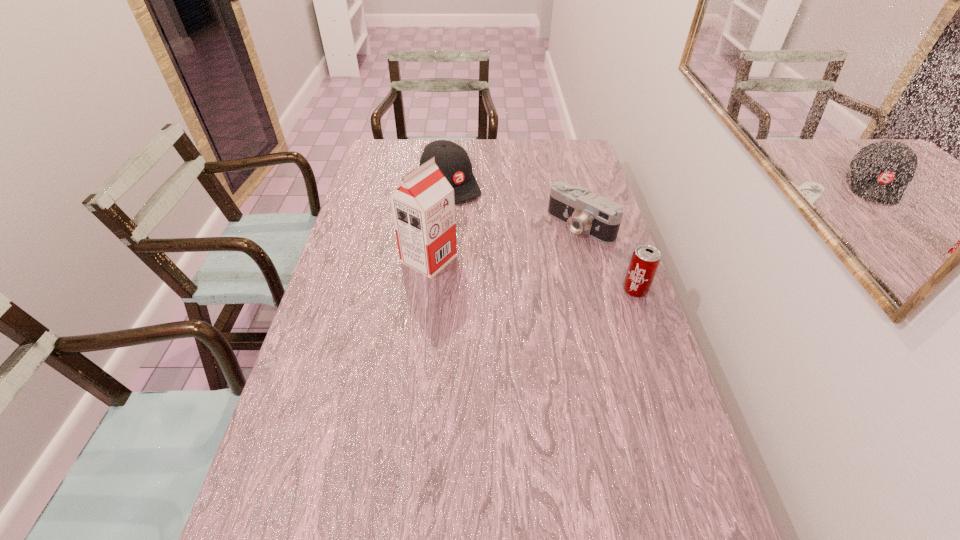
Find the location of `the tallest object`. the tallest object is located at coordinates (423, 208).

This screenshot has width=960, height=540. In order to click on the nearest object in this screenshot , I will do `click(645, 260)`.

Where is `baseball cap`? The width and height of the screenshot is (960, 540). baseball cap is located at coordinates click(452, 159).

Where is `the shortest object`? Image resolution: width=960 pixels, height=540 pixels. the shortest object is located at coordinates (598, 217).

You are a GUI agent. You are given a task and a screenshot of the screen. Output one action in this format:
    pyautogui.click(x=<x>, y=<y>)
    Task: Click on the vacant space situated on the right of the tallest object
    
    Given the screenshot: What is the action you would take?
    pyautogui.click(x=572, y=259)

Locate an element on the screen. This screenshot has height=540, width=960. free region located on the back of the beer can is located at coordinates (618, 241).

Locate an element on the screen. vacant area located with a logo on the front of the farthest object is located at coordinates (526, 264).

You are a GUI agent. You are given a task and a screenshot of the screen. Output one action in this format:
    pyautogui.click(x=<x>, y=<y>)
    Task: Click on the vacant space located with a logo on the front of the farthest object
    
    Given the screenshot: What is the action you would take?
    pyautogui.click(x=475, y=212)

The width and height of the screenshot is (960, 540). In order to click on free location located with a logo on the front of the farthest object in this screenshot , I will do `click(500, 238)`.

Find the location of `free spot located 0.110m on the lens of the shortest object`. free spot located 0.110m on the lens of the shortest object is located at coordinates (542, 256).